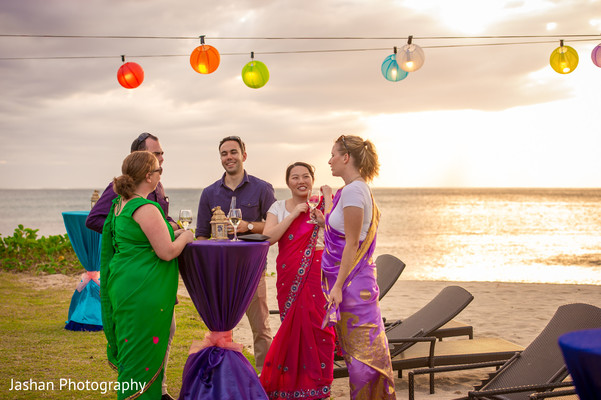
Image resolution: width=601 pixels, height=400 pixels. Identify the location of blue table cloth. (78, 239).